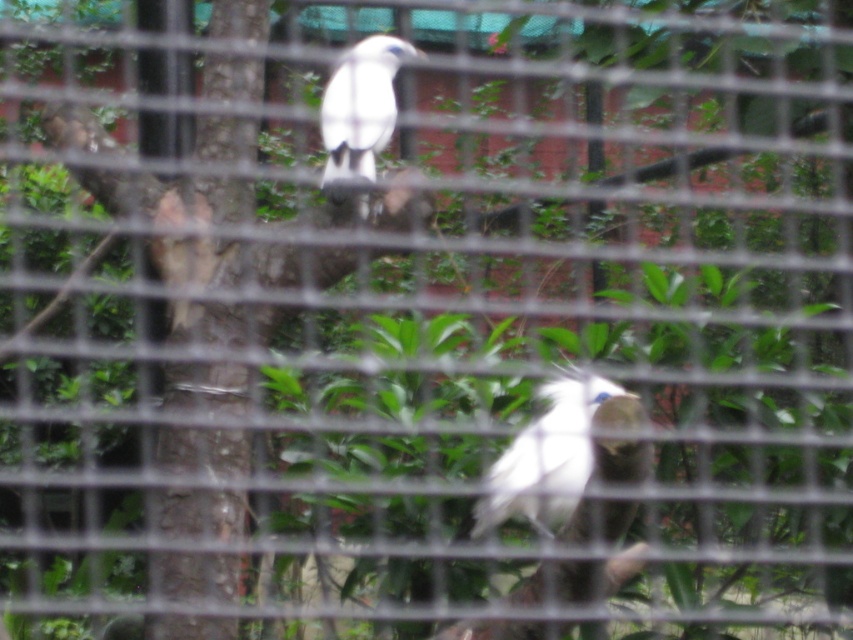
Who is more distant from viewer, (564, 486) or (352, 106)?

Positioned behind is point (352, 106).

Is white feathered bird at center wider than white feathered bird at upper center?

Yes.

The height and width of the screenshot is (640, 853). I want to click on white feathered bird at center, so click(x=546, y=456).